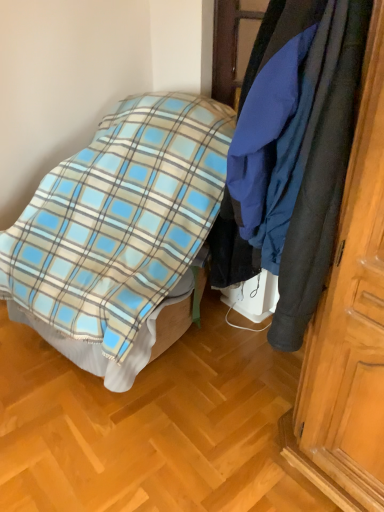
Describe the element at coordinates (313, 146) in the screenshot. I see `dark blue fabric coat at right` at that location.

In order to face dark blue fabric coat at right, should I rotate leftwards or rightwards?

To face it directly, rotate right by 12.380 degrees.

Locate an element on the screen. dark blue fabric coat at right is located at coordinates (313, 146).

Describe the element at coordinates (118, 232) in the screenshot. The image size is (384, 512). I see `plaid fabric bed at center` at that location.

Locate an element on the screen. This screenshot has width=384, height=512. plaid fabric bed at center is located at coordinates (118, 232).

This screenshot has height=512, width=384. In order to click on dark blue fabric coat at right in this screenshot , I will do `click(313, 146)`.

Which is more to the left, plaid fabric bed at center or dark blue fabric coat at right?

plaid fabric bed at center is more to the left.

Does plaid fabric bed at center lie in front of dark blue fabric coat at right?

No, plaid fabric bed at center is further to the viewer.

Is point (152, 102) closer or farther from the camera than point (321, 39)?

Point (152, 102) is positioned farther from the camera compared to point (321, 39).

From the image's perspective, is plaid fabric bed at center located beneath dark blue fabric coat at right?

Indeed, from the image's perspective, plaid fabric bed at center is shown beneath dark blue fabric coat at right.

From a real-world perspective, is plaid fabric bed at center located higher than dark blue fabric coat at right?

Actually, plaid fabric bed at center is physically below dark blue fabric coat at right in the real world.

From the picture: Considering the relative sizes of plaid fabric bed at center and dark blue fabric coat at right in the image provided, is plaid fabric bed at center thinner than dark blue fabric coat at right?

No.

Between plaid fabric bed at center and dark blue fabric coat at right, which one has more height?

Standing taller between the two is plaid fabric bed at center.

Considering the relative sizes of plaid fabric bed at center and dark blue fabric coat at right in the image provided, is plaid fabric bed at center bigger than dark blue fabric coat at right?

Indeed, plaid fabric bed at center has a larger size compared to dark blue fabric coat at right.

Would you say plaid fabric bed at center contains dark blue fabric coat at right?

No, dark blue fabric coat at right is not inside plaid fabric bed at center.

Does plaid fabric bed at center touch dark blue fabric coat at right?

No, plaid fabric bed at center is not with dark blue fabric coat at right.

Could you tell me if plaid fabric bed at center is turned towards dark blue fabric coat at right?

No, plaid fabric bed at center does not turn towards dark blue fabric coat at right.

How many degrees apart are the facing directions of plaid fabric bed at center and dark blue fabric coat at right?

There is a 2.51-degree angle between the facing directions of plaid fabric bed at center and dark blue fabric coat at right.

How much distance is there between plaid fabric bed at center and dark blue fabric coat at right?

The distance of plaid fabric bed at center from dark blue fabric coat at right is 76.46 centimeters.

This screenshot has width=384, height=512. Identify the location of bed that appears on the left of dark blue fabric coat at right. (118, 232).

Does dark blue fabric coat at right appear on the right side of plaid fabric bed at center?

Indeed, dark blue fabric coat at right is positioned on the right side of plaid fabric bed at center.

Which object is closer to the camera taking this photo, dark blue fabric coat at right or plaid fabric bed at center?

Positioned in front is dark blue fabric coat at right.

Does point (313, 242) appear closer or farther from the camera than point (100, 340)?

Point (313, 242) is positioned closer to the camera compared to point (100, 340).

From the image's perspective, which one is positioned higher, dark blue fabric coat at right or plaid fabric bed at center?

dark blue fabric coat at right.

Consider the image. From a real-world perspective, is dark blue fabric coat at right positioned over plaid fabric bed at center based on gravity?

Correct, in the physical world, dark blue fabric coat at right is higher than plaid fabric bed at center.

Which of these two, dark blue fabric coat at right or plaid fabric bed at center, is wider?

plaid fabric bed at center is wider.

Which of these two, dark blue fabric coat at right or plaid fabric bed at center, stands taller?

plaid fabric bed at center is taller.

Considering the relative sizes of dark blue fabric coat at right and plaid fabric bed at center in the image provided, is dark blue fabric coat at right smaller than plaid fabric bed at center?

Correct, dark blue fabric coat at right occupies less space than plaid fabric bed at center.

Is dark blue fabric coat at right not within plaid fabric bed at center?

dark blue fabric coat at right lies outside plaid fabric bed at center's area.

Is dark blue fabric coat at right in contact with plaid fabric bed at center?

No.

Is dark blue fabric coat at right oriented towards plaid fabric bed at center?

No.

At what (x,y) coordinates should I click in order to perform the action: click on cloak on the right of the plaid fabric bed at center. Please return your answer as a coordinate pair (x, y). The width and height of the screenshot is (384, 512). Looking at the image, I should click on (313, 146).

Find the location of a particular element. cloak in front of the plaid fabric bed at center is located at coordinates (313, 146).

Find the location of a particular element. bed below the dark blue fabric coat at right (from a real-world perspective) is located at coordinates (118, 232).